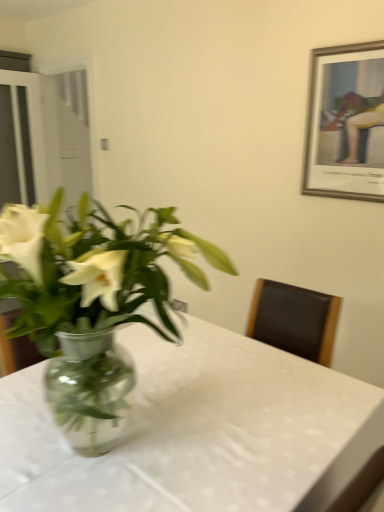
Question: Considering the relative sizes of transparent glass door at left, the second glass door viewed from the right, and silver/golden frame at upper right in the image provided, is transparent glass door at left, the second glass door viewed from the right, wider than silver/golden frame at upper right?

Choices:
 (A) yes
 (B) no

Answer: (A)

Question: From a real-world perspective, is transparent glass door at left, arranged as the first glass door when viewed from the left, beneath silver/golden frame at upper right?

Choices:
 (A) yes
 (B) no

Answer: (A)

Question: Is silver/golden frame at upper right a part of transparent glass door at left, arranged as the first glass door when viewed from the left?

Choices:
 (A) yes
 (B) no

Answer: (B)

Question: Could you tell me if transparent glass door at left, the second glass door viewed from the right, is facing silver/golden frame at upper right?

Choices:
 (A) yes
 (B) no

Answer: (A)

Question: Does transparent glass door at left, the second glass door viewed from the right, have a greater height compared to silver/golden frame at upper right?

Choices:
 (A) yes
 (B) no

Answer: (A)

Question: Is silver/golden frame at upper right at the back of transparent glass door at left, arranged as the first glass door when viewed from the left?

Choices:
 (A) no
 (B) yes

Answer: (A)

Question: From the image's perspective, is clear glass vase at center located beneath transparent glass door at left, which is the second glass door in left-to-right order?

Choices:
 (A) yes
 (B) no

Answer: (A)

Question: From a real-world perspective, is clear glass vase at center physically above transparent glass door at left, which is the first glass door from right to left?

Choices:
 (A) yes
 (B) no

Answer: (B)

Question: Is clear glass vase at center facing towards transparent glass door at left, which is the first glass door from right to left?

Choices:
 (A) yes
 (B) no

Answer: (B)

Question: Is clear glass vase at center closer to the viewer compared to transparent glass door at left, which is the first glass door from right to left?

Choices:
 (A) yes
 (B) no

Answer: (A)

Question: Are clear glass vase at center and transparent glass door at left, which is the first glass door from right to left, far apart?

Choices:
 (A) no
 (B) yes

Answer: (B)

Question: Is clear glass vase at center positioned with its back to transparent glass door at left, which is the second glass door in left-to-right order?

Choices:
 (A) yes
 (B) no

Answer: (B)

Question: From the image's perspective, is transparent glass door at left, arranged as the first glass door when viewed from the left, above transparent glass table at center?

Choices:
 (A) no
 (B) yes

Answer: (B)